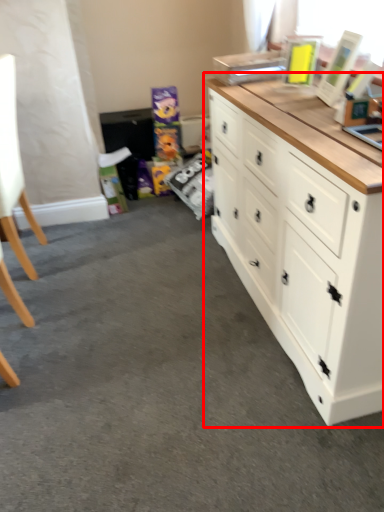
Question: Considering the relative positions of chest of drawers (annotated by the red box) and swivel chair in the image provided, where is chest of drawers (annotated by the red box) located with respect to the staircase?

Choices:
 (A) left
 (B) right

Answer: (B)